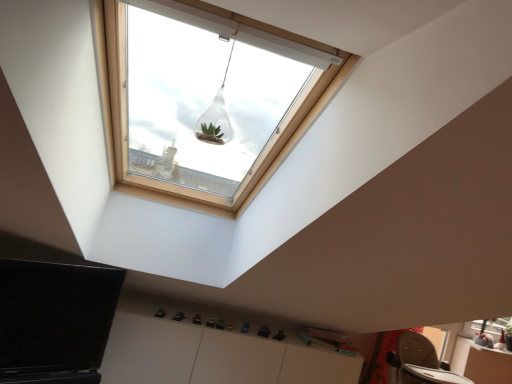
Question: Is white matte cabinet at lower center situated inside transparent glass terrarium at upper center or outside?

Choices:
 (A) inside
 (B) outside

Answer: (B)

Question: Looking at their shapes, would you say white matte cabinet at lower center is wider or thinner than transparent glass terrarium at upper center?

Choices:
 (A) wide
 (B) thin

Answer: (A)

Question: From a real-world perspective, is white matte cabinet at lower center physically located above or below transparent glass terrarium at upper center?

Choices:
 (A) above
 (B) below

Answer: (B)

Question: In terms of size, does transparent glass terrarium at upper center appear bigger or smaller than white matte cabinet at lower center?

Choices:
 (A) big
 (B) small

Answer: (B)

Question: Would you say transparent glass terrarium at upper center is inside or outside white matte cabinet at lower center?

Choices:
 (A) inside
 (B) outside

Answer: (B)

Question: Would you say transparent glass terrarium at upper center is to the left or to the right of white matte cabinet at lower center in the picture?

Choices:
 (A) right
 (B) left

Answer: (A)

Question: Looking at their shapes, would you say transparent glass terrarium at upper center is wider or thinner than white matte cabinet at lower center?

Choices:
 (A) thin
 (B) wide

Answer: (A)